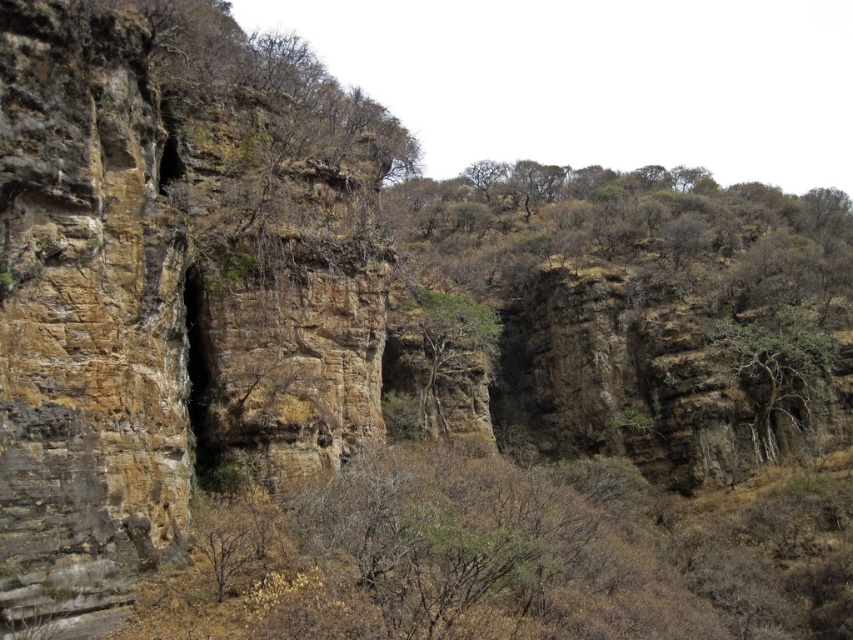
Question: Which point is closer to the camera taking this photo?

Choices:
 (A) (404, 330)
 (B) (791, 381)

Answer: (B)

Question: Does green leafy tree at center have a lesser width compared to brown textured tree at center?

Choices:
 (A) no
 (B) yes

Answer: (A)

Question: Is green leafy tree at center bigger than brown textured tree at center?

Choices:
 (A) yes
 (B) no

Answer: (A)

Question: Does green leafy tree at center have a lesser width compared to brown textured tree at center?

Choices:
 (A) yes
 (B) no

Answer: (B)